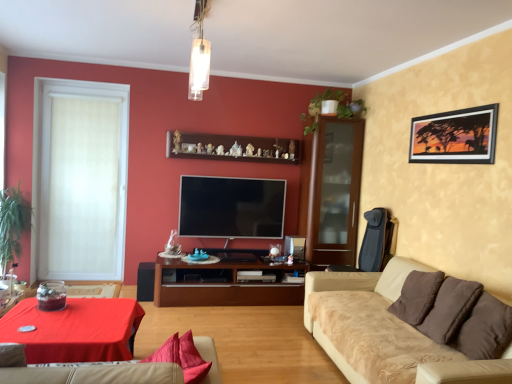
Question: From the image's perspective, is white glass pendant light at upper center over beige fabric couch at lower right, marked as the first studio couch in a right-to-left arrangement?

Choices:
 (A) yes
 (B) no

Answer: (A)

Question: Does white glass pendant light at upper center have a greater width compared to beige fabric couch at lower right, marked as the first studio couch in a right-to-left arrangement?

Choices:
 (A) yes
 (B) no

Answer: (B)

Question: From the image's perspective, is white glass pendant light at upper center beneath beige fabric couch at lower right, placed as the second studio couch when sorted from left to right?

Choices:
 (A) yes
 (B) no

Answer: (B)

Question: Can you confirm if white glass pendant light at upper center is smaller than beige fabric couch at lower right, marked as the first studio couch in a right-to-left arrangement?

Choices:
 (A) yes
 (B) no

Answer: (A)

Question: From a real-world perspective, is white glass pendant light at upper center over beige fabric couch at lower right, placed as the second studio couch when sorted from left to right?

Choices:
 (A) yes
 (B) no

Answer: (A)

Question: Is white glass pendant light at upper center aimed at beige fabric couch at lower right, placed as the second studio couch when sorted from left to right?

Choices:
 (A) no
 (B) yes

Answer: (A)

Question: Is beige fabric couch at lower center, placed as the 2th studio couch when sorted from right to left, taller than beige fabric couch at lower right, placed as the second studio couch when sorted from left to right?

Choices:
 (A) yes
 (B) no

Answer: (B)

Question: Is the position of beige fabric couch at lower center, acting as the first studio couch starting from the left, less distant than that of beige fabric couch at lower right, placed as the second studio couch when sorted from left to right?

Choices:
 (A) no
 (B) yes

Answer: (B)

Question: Can you confirm if beige fabric couch at lower center, acting as the first studio couch starting from the left, is thinner than beige fabric couch at lower right, marked as the first studio couch in a right-to-left arrangement?

Choices:
 (A) yes
 (B) no

Answer: (A)

Question: Does beige fabric couch at lower center, acting as the first studio couch starting from the left, have a larger size compared to beige fabric couch at lower right, marked as the first studio couch in a right-to-left arrangement?

Choices:
 (A) no
 (B) yes

Answer: (A)

Question: From the image's perspective, is beige fabric couch at lower center, acting as the first studio couch starting from the left, located above beige fabric couch at lower right, marked as the first studio couch in a right-to-left arrangement?

Choices:
 (A) no
 (B) yes

Answer: (B)

Question: From a real-world perspective, is beige fabric couch at lower center, placed as the 2th studio couch when sorted from right to left, located beneath beige fabric couch at lower right, placed as the second studio couch when sorted from left to right?

Choices:
 (A) yes
 (B) no

Answer: (B)

Question: Considering the relative positions of beige fabric couch at lower right, placed as the second studio couch when sorted from left to right, and wooden shelf at upper center in the image provided, is beige fabric couch at lower right, placed as the second studio couch when sorted from left to right, to the right of wooden shelf at upper center from the viewer's perspective?

Choices:
 (A) no
 (B) yes

Answer: (B)